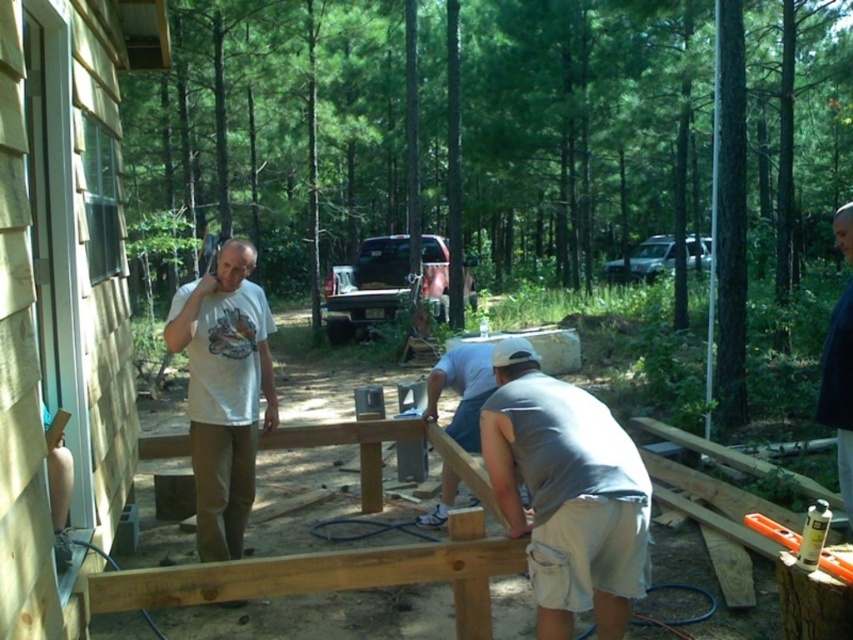
Question: From the image, what is the correct spatial relationship of white cotton t-shirt at center in relation to gray fabric shirt at center?

Choices:
 (A) above
 (B) below

Answer: (A)

Question: Is white cotton t-shirt at center to the right of gray fabric shirt at center from the viewer's perspective?

Choices:
 (A) yes
 (B) no

Answer: (B)

Question: Which point is farther to the camera?

Choices:
 (A) white cotton t-shirt at center
 (B) dark blue shirt at upper right

Answer: (A)

Question: Which object is positioned closest to the white cotton t-shirt at center?

Choices:
 (A) dark blue shirt at upper right
 (B) gray cotton shirt at center
 (C) gray fabric shirt at center

Answer: (C)

Question: Among these points, which one is nearest to the camera?

Choices:
 (A) (195, 369)
 (B) (572, 525)
 (C) (444, 509)
 (D) (821, 401)

Answer: (B)

Question: Is gray cotton shirt at center to the left of gray fabric shirt at center from the viewer's perspective?

Choices:
 (A) yes
 (B) no

Answer: (B)